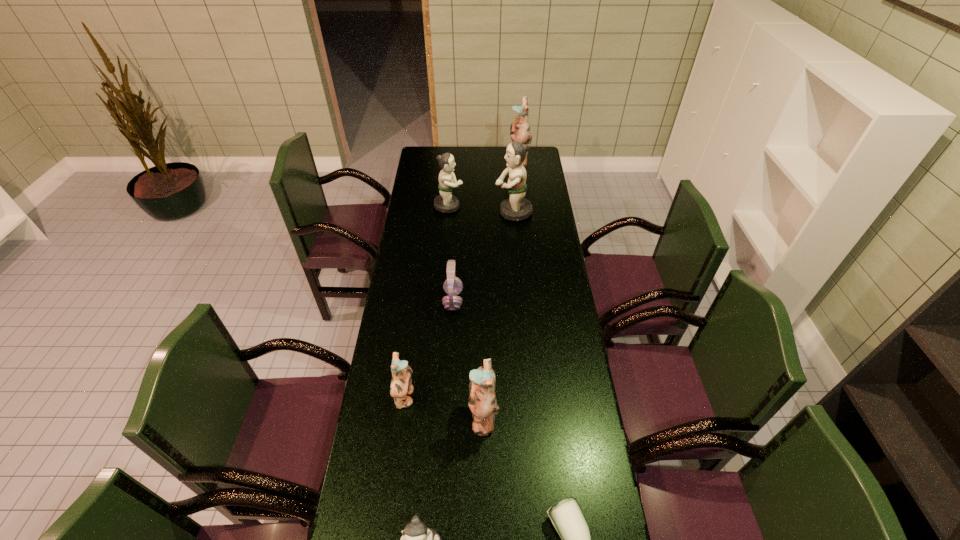
Locate an element on the screen. object located in the far edge section of the desktop is located at coordinates (519, 130).

Locate an element on the screen. This screenshot has height=540, width=960. object at the far right corner is located at coordinates (519, 130).

In the image, there is a desktop. What are the coordinates of `free space at the far edge` in the screenshot? It's located at (457, 155).

I want to click on blank space at the left edge of the desktop, so click(x=387, y=346).

This screenshot has height=540, width=960. In the image, there is a desktop. What are the coordinates of `free space at the right edge` in the screenshot? It's located at (535, 238).

Locate an element on the screen. Image resolution: width=960 pixels, height=540 pixels. vacant space that is in between the biggest pink figurine and the leftmost pink figurine is located at coordinates (462, 280).

Where is `free space that is in between the fourth figurine from left to right and the leftmost pink figurine`? The image size is (960, 540). free space that is in between the fourth figurine from left to right and the leftmost pink figurine is located at coordinates (444, 407).

The image size is (960, 540). I want to click on free space between the headset and the leftmost pink figurine, so pos(429,349).

The image size is (960, 540). I want to click on free spot between the fourth object from right to left and the headset, so click(468, 359).

Identify which object is located as the third nearest to the nearest figurine. Please provide its 2D coordinates. Your answer should be formatted as a tuple, i.e. [(x, y)], where the tuple contains the x and y coordinates of a point satisfying the conditions above.

[(401, 384)]